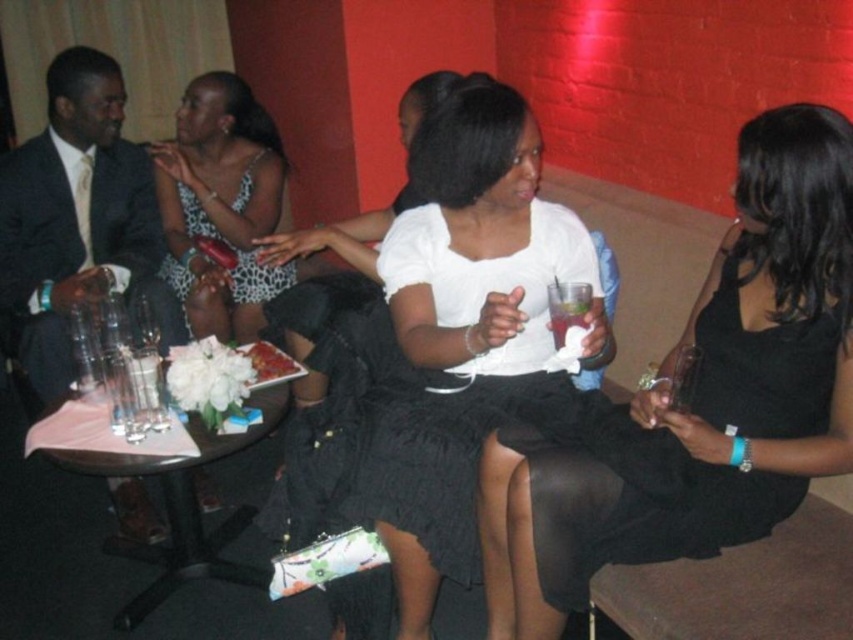
Does matte white blouse at center have a greater height compared to wooden round table at lower left?

Indeed, matte white blouse at center has a greater height compared to wooden round table at lower left.

Looking at this image, does matte white blouse at center have a larger size compared to wooden round table at lower left?

Incorrect, matte white blouse at center is not larger than wooden round table at lower left.

The width and height of the screenshot is (853, 640). Find the location of `matte white blouse at center`. matte white blouse at center is located at coordinates (699, 400).

You are a GUI agent. You are given a task and a screenshot of the screen. Output one action in this format:
    pyautogui.click(x=<x>, y=<y>)
    Task: Click on the matte white blouse at center
    
    Given the screenshot: What is the action you would take?
    pyautogui.click(x=699, y=400)

Is point (497, 493) closer to viewer compared to point (184, 220)?

Yes, it is in front of point (184, 220).

The height and width of the screenshot is (640, 853). What do you see at coordinates (699, 400) in the screenshot?
I see `matte white blouse at center` at bounding box center [699, 400].

Between point (784, 346) and point (292, 272), which one is positioned behind?

Point (292, 272)

Identify the location of matte white blouse at center. This screenshot has height=640, width=853. (699, 400).

Can you confirm if leopard print fabric dress at center is positioned above clear plastic cup at center?

Yes.

This screenshot has width=853, height=640. What do you see at coordinates (231, 248) in the screenshot? I see `leopard print fabric dress at center` at bounding box center [231, 248].

Identify the location of leopard print fabric dress at center. (231, 248).

You are a GUI agent. You are given a task and a screenshot of the screen. Output one action in this format:
    pyautogui.click(x=<x>, y=<y>)
    Task: Click on the leopard print fabric dress at center
    The height and width of the screenshot is (640, 853).
    Given the screenshot: What is the action you would take?
    pyautogui.click(x=231, y=248)